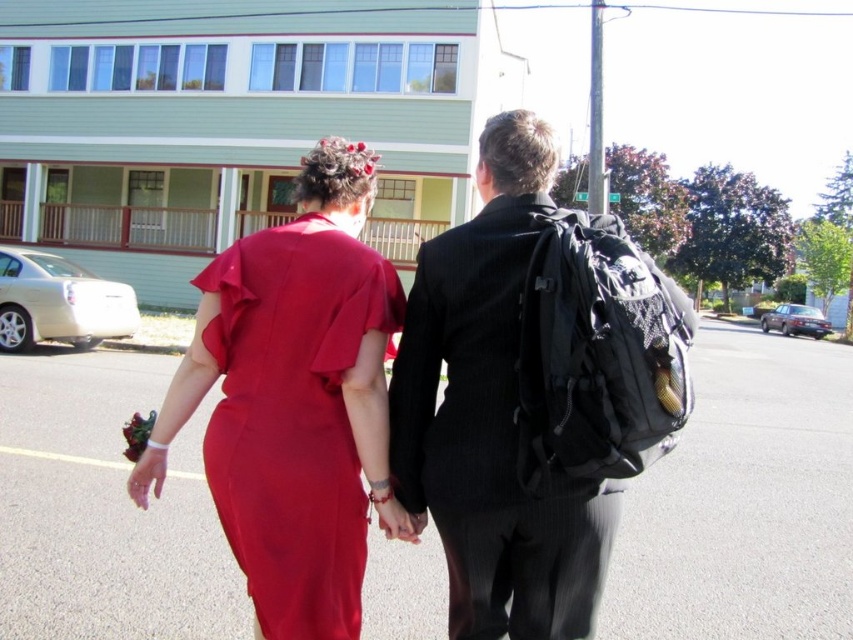
Is the position of black pinstripe suit at center more distant than that of matte red dress at center?

No, it is in front of matte red dress at center.

Is black pinstripe suit at center taller than matte red dress at center?

Yes, black pinstripe suit at center is taller than matte red dress at center.

I want to click on black pinstripe suit at center, so click(532, 392).